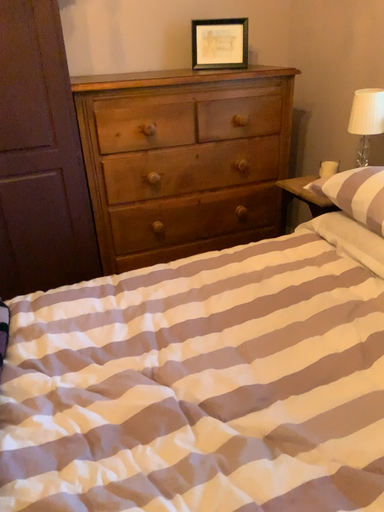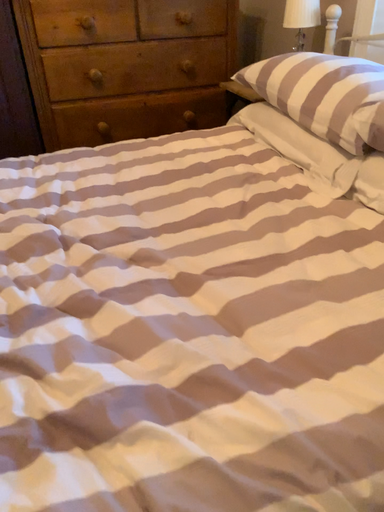
Question: Which way did the camera rotate in the video?

Choices:
 (A) rotated downward
 (B) rotated upward

Answer: (A)